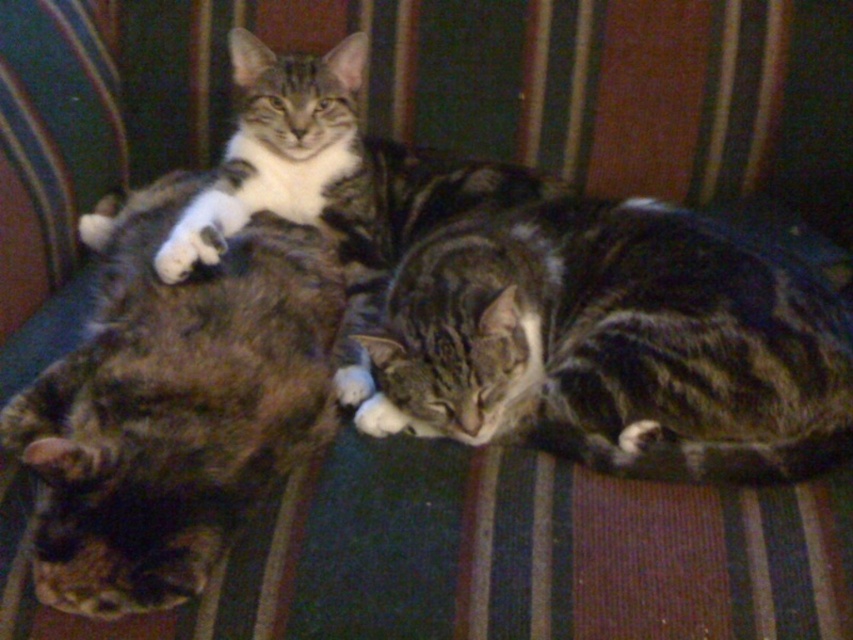
Question: Which object is closer to the camera taking this photo?

Choices:
 (A) tabby fur cat at left
 (B) tabby fur cat at center

Answer: (A)

Question: Which point appears closest to the camera in this image?

Choices:
 (A) (363, 420)
 (B) (134, 609)

Answer: (B)

Question: Is tabby fur cat at center further to camera compared to tabby fur cat at left?

Choices:
 (A) yes
 (B) no

Answer: (A)

Question: Considering the relative positions of tabby fur cat at center and tabby fur cat at left in the image provided, where is tabby fur cat at center located with respect to tabby fur cat at left?

Choices:
 (A) below
 (B) above

Answer: (B)

Question: Which object is farther from the camera taking this photo?

Choices:
 (A) tabby fur cat at left
 (B) tabby fur cat at center

Answer: (B)

Question: Is tabby fur cat at center positioned behind tabby fur cat at left?

Choices:
 (A) no
 (B) yes

Answer: (B)